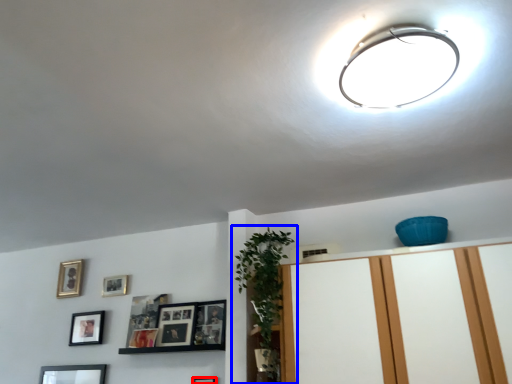
Question: Which object appears closest to the camera in this image, picture frame (highlighted by a red box) or houseplant (highlighted by a blue box)?

Choices:
 (A) picture frame
 (B) houseplant

Answer: (B)